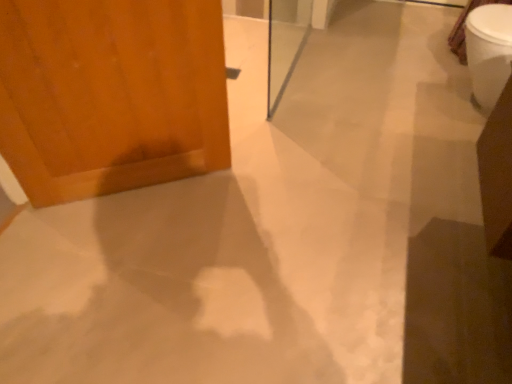
Question: Does white glossy toilet bowl at upper right have a smaller size compared to transparent glass screen door at center?

Choices:
 (A) no
 (B) yes

Answer: (A)

Question: Considering the relative sizes of white glossy toilet bowl at upper right and transparent glass screen door at center in the image provided, is white glossy toilet bowl at upper right shorter than transparent glass screen door at center?

Choices:
 (A) no
 (B) yes

Answer: (B)

Question: From a real-world perspective, is white glossy toilet bowl at upper right positioned over transparent glass screen door at center based on gravity?

Choices:
 (A) no
 (B) yes

Answer: (A)

Question: Considering the relative positions of white glossy toilet bowl at upper right and transparent glass screen door at center in the image provided, is white glossy toilet bowl at upper right in front of transparent glass screen door at center?

Choices:
 (A) no
 (B) yes

Answer: (A)

Question: Is white glossy toilet bowl at upper right far from transparent glass screen door at center?

Choices:
 (A) yes
 (B) no

Answer: (A)

Question: Is white glossy toilet bowl at upper right situated inside transparent glass screen door at center or outside?

Choices:
 (A) outside
 (B) inside

Answer: (A)

Question: From the image's perspective, is white glossy toilet bowl at upper right located above or below transparent glass screen door at center?

Choices:
 (A) below
 (B) above

Answer: (A)

Question: Relative to transparent glass screen door at center, is white glossy toilet bowl at upper right in front or behind?

Choices:
 (A) front
 (B) behind

Answer: (B)

Question: Is point (507, 51) closer or farther from the camera than point (280, 67)?

Choices:
 (A) farther
 (B) closer

Answer: (B)

Question: Considering the positions of transparent glass screen door at center and white glossy toilet bowl at upper right in the image, is transparent glass screen door at center taller or shorter than white glossy toilet bowl at upper right?

Choices:
 (A) short
 (B) tall

Answer: (B)

Question: From a real-world perspective, relative to white glossy toilet bowl at upper right, is transparent glass screen door at center vertically above or below?

Choices:
 (A) above
 (B) below

Answer: (A)

Question: From the image's perspective, is transparent glass screen door at center above or below white glossy toilet bowl at upper right?

Choices:
 (A) above
 (B) below

Answer: (A)

Question: In the image, is transparent glass screen door at center on the left side or the right side of white glossy toilet bowl at upper right?

Choices:
 (A) right
 (B) left

Answer: (B)

Question: Does point (475, 76) appear closer or farther from the camera than point (28, 72)?

Choices:
 (A) farther
 (B) closer

Answer: (A)

Question: From the image's perspective, is white glossy toilet bowl at upper right above or below wooden door at left?

Choices:
 (A) below
 (B) above

Answer: (B)